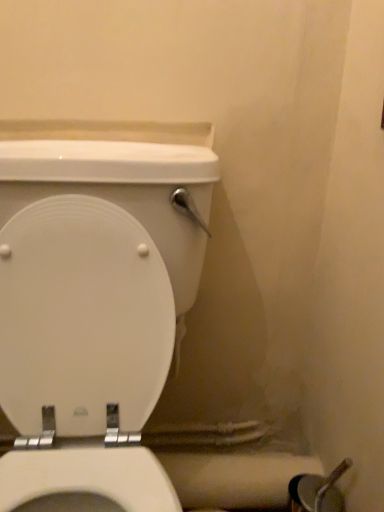
What do you see at coordinates (235, 478) in the screenshot? I see `white matte toilet paper at lower right` at bounding box center [235, 478].

Identify the location of white matte toilet paper at lower right. (235, 478).

At what (x,y) coordinates should I click in order to perform the action: click on white glossy toilet at center. Please return your answer as a coordinate pair (x, y). The image size is (384, 512). Looking at the image, I should click on (96, 278).

Describe the element at coordinates (96, 278) in the screenshot. This screenshot has width=384, height=512. I see `white glossy toilet at center` at that location.

Find the location of a particular element. The image size is (384, 512). white matte toilet paper at lower right is located at coordinates (235, 478).

Is white matte toilet paper at lower right at the left side of white glossy toilet at center?

No.

Which object is closer to the camera taking this photo, white matte toilet paper at lower right or white glossy toilet at center?

white glossy toilet at center.

Is point (264, 469) closer or farther from the camera than point (12, 228)?

Clearly, point (264, 469) is more distant from the camera than point (12, 228).

From the image's perspective, is white matte toilet paper at lower right over white glossy toilet at center?

No, from the image's perspective, white matte toilet paper at lower right is not on top of white glossy toilet at center.

From a real-world perspective, which object rests below the other?

white matte toilet paper at lower right.

Between white matte toilet paper at lower right and white glossy toilet at center, which one has larger width?

With larger width is white glossy toilet at center.

Is white matte toilet paper at lower right shorter than white glossy toilet at center?

Yes, white matte toilet paper at lower right is shorter than white glossy toilet at center.

Based on their sizes in the image, would you say white matte toilet paper at lower right is bigger or smaller than white glossy toilet at center?

In the image, white matte toilet paper at lower right appears to be smaller than white glossy toilet at center.

Is white matte toilet paper at lower right outside of white glossy toilet at center?

That's incorrect, white matte toilet paper at lower right is not completely outside white glossy toilet at center.

Is white matte toilet paper at lower right in contact with white glossy toilet at center?

They are not placed beside each other.

Is white matte toilet paper at lower right turned away from white glossy toilet at center?

That's not correct — white matte toilet paper at lower right is not looking away from white glossy toilet at center.

How different are the orientations of white matte toilet paper at lower right and white glossy toilet at center in degrees?

There is a 0.654-degree angle between the facing directions of white matte toilet paper at lower right and white glossy toilet at center.

I want to click on toilet paper that is on the right side of white glossy toilet at center, so click(235, 478).

Is white glossy toilet at center to the left of white matte toilet paper at lower right from the viewer's perspective?

Indeed, white glossy toilet at center is positioned on the left side of white matte toilet paper at lower right.

In the image, is white glossy toilet at center positioned in front of or behind white matte toilet paper at lower right?

white glossy toilet at center is in front of white matte toilet paper at lower right.

Which is nearer, (175, 320) or (222, 499)?

Clearly, point (175, 320) is closer to the camera than point (222, 499).

From the image's perspective, which object appears higher, white glossy toilet at center or white matte toilet paper at lower right?

white glossy toilet at center.

From a real-world perspective, does white glossy toilet at center sit lower than white matte toilet paper at lower right?

Incorrect, from a real-world perspective, white glossy toilet at center is higher than white matte toilet paper at lower right.

Based on the photo, is white glossy toilet at center wider or thinner than white matte toilet paper at lower right?

In the image, white glossy toilet at center appears to be wider than white matte toilet paper at lower right.

In terms of height, does white glossy toilet at center look taller or shorter compared to white matte toilet paper at lower right?

white glossy toilet at center is taller than white matte toilet paper at lower right.

Considering the relative sizes of white glossy toilet at center and white matte toilet paper at lower right in the image provided, is white glossy toilet at center bigger than white matte toilet paper at lower right?

Yes, white glossy toilet at center is bigger than white matte toilet paper at lower right.

Is white glossy toilet at center located outside white matte toilet paper at lower right?

Absolutely, white glossy toilet at center is external to white matte toilet paper at lower right.

Would you say white glossy toilet at center is a long distance from white matte toilet paper at lower right?

No, there isn't a large distance between white glossy toilet at center and white matte toilet paper at lower right.

Is white glossy toilet at center looking in the opposite direction of white matte toilet paper at lower right?

white glossy toilet at center is not turned away from white matte toilet paper at lower right.

Can you tell me how much white glossy toilet at center and white matte toilet paper at lower right differ in facing direction?

white glossy toilet at center and white matte toilet paper at lower right are facing 0.654 degrees away from each other.

The image size is (384, 512). What are the coordinates of `toilet paper behind the white glossy toilet at center` in the screenshot? It's located at (235, 478).

This screenshot has height=512, width=384. What are the coordinates of `toilet paper below the white glossy toilet at center (from a real-world perspective)` in the screenshot? It's located at (235, 478).

This screenshot has width=384, height=512. There is a white matte toilet paper at lower right. In order to click on toilet above it (from a real-world perspective) in this screenshot , I will do `click(96, 278)`.